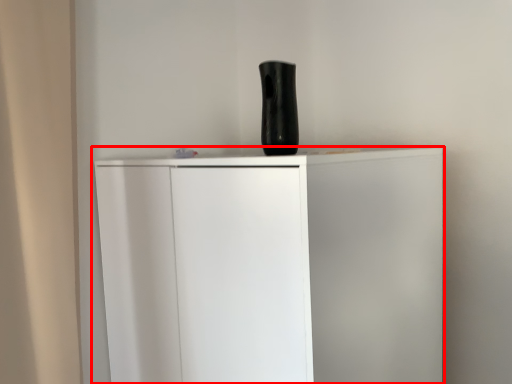
Question: Observing the image, what is the correct spatial positioning of cupboard (annotated by the red box) in reference to vase?

Choices:
 (A) right
 (B) left

Answer: (B)